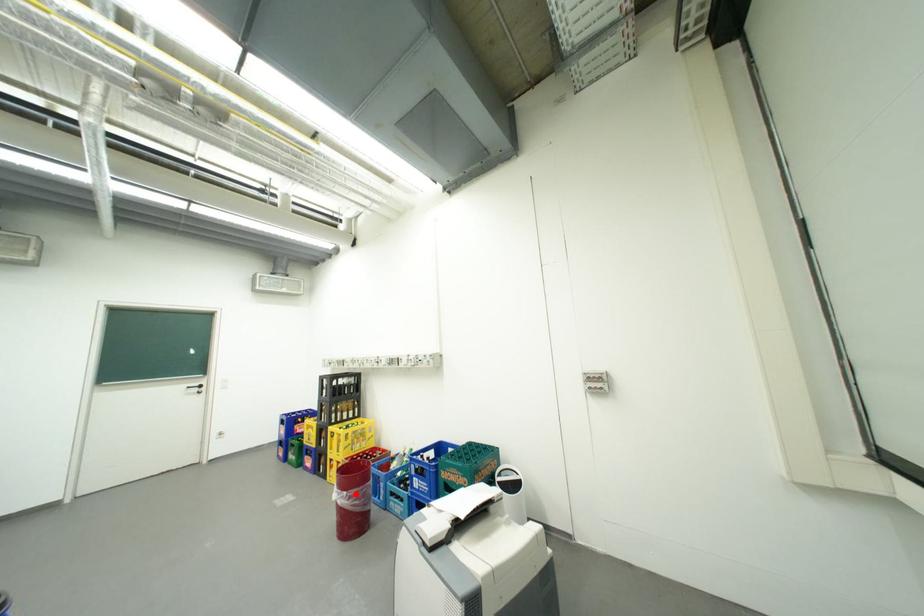
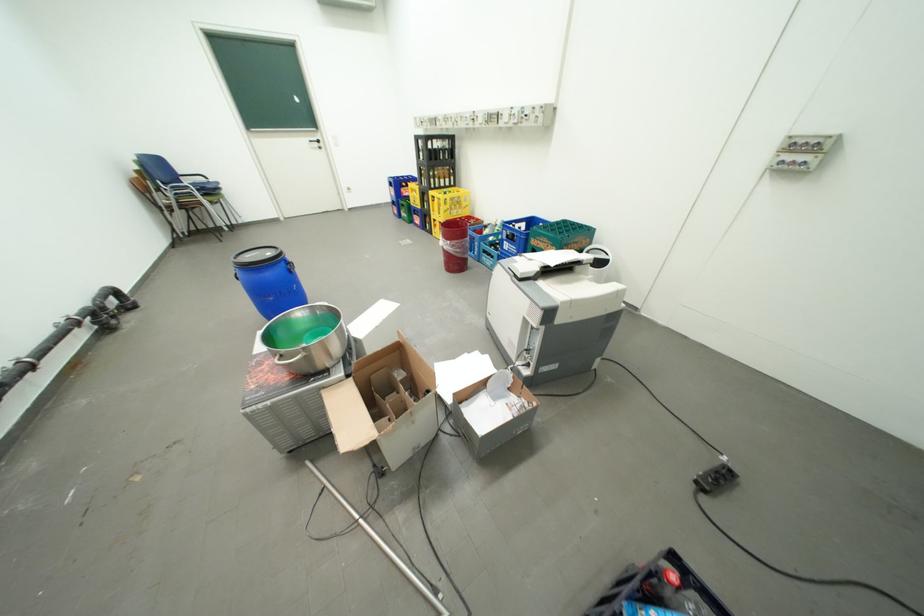
Question: I am providing you with two images of the same scene from different viewpoints. Image1 has a red point marked. In image2, the corresponding 3D location appears at what relative position? Reply with the corresponding letter.

Choices:
 (A) Closer
 (B) Farther

Answer: (A)